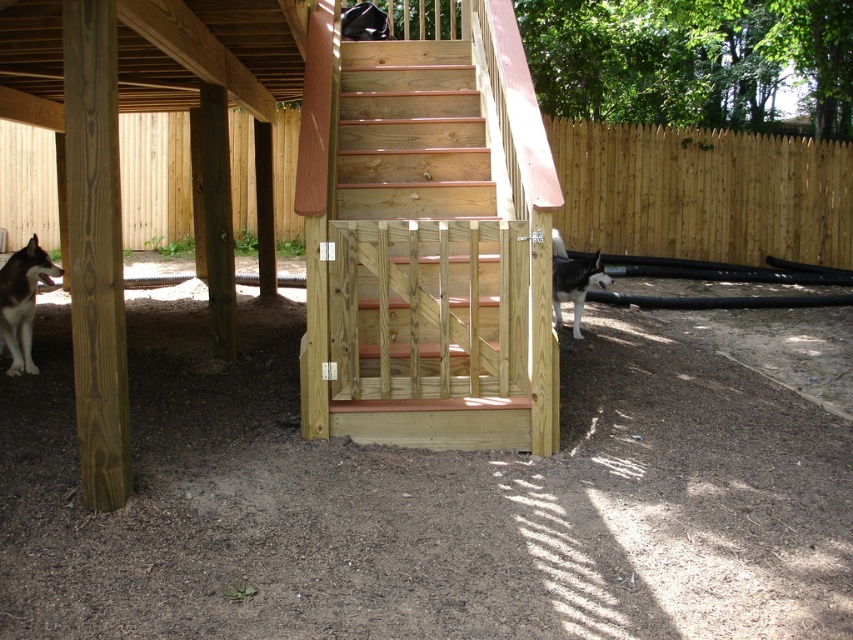
Does white fur dog at lower left have a larger size compared to white fur dog at right?

No.

Can you confirm if white fur dog at lower left is taller than white fur dog at right?

Yes.

Where is `white fur dog at lower left`? The height and width of the screenshot is (640, 853). white fur dog at lower left is located at coordinates coord(21,301).

The image size is (853, 640). What are the coordinates of `natural wood stairs at center` in the screenshot? It's located at (421, 240).

Does point (424, 410) come farther from viewer compared to point (9, 368)?

No, it is not.

Who is more distant from viewer, [357,276] or [21,326]?

The point [21,326] is behind.

Image resolution: width=853 pixels, height=640 pixels. I want to click on natural wood stairs at center, so click(421, 240).

Is natural wood stairs at center closer to the viewer compared to white fur dog at right?

Yes, natural wood stairs at center is in front of white fur dog at right.

Can you confirm if natural wood stairs at center is thinner than white fur dog at right?

No, natural wood stairs at center is not thinner than white fur dog at right.

Who is more forward, (428, 150) or (589, 275)?

Point (428, 150) is more forward.

Image resolution: width=853 pixels, height=640 pixels. In order to click on natural wood stairs at center in this screenshot , I will do `click(421, 240)`.